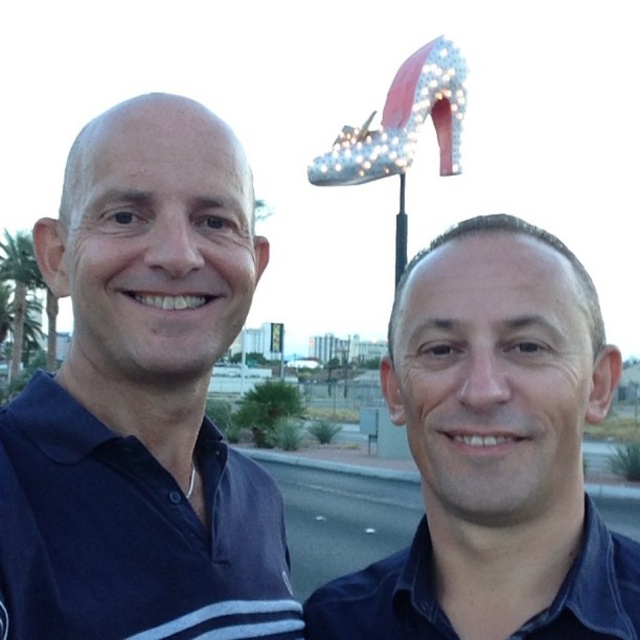
You are taking a photo of the blue cotton polo shirt at left and the green leafy palm tree at left. Which object appears narrower in the photo?

The blue cotton polo shirt at left appears narrower than the green leafy palm tree at left in the photo.

Consider the image. You are a photographer setting up for a group photo. You need to position two people so that there is at least 1.5 meters between them for proper framing. Can the current distance between the blue cotton polo shirt at left and the navy blue cotton polo shirt at center work?

The blue cotton polo shirt at left is 1.60 meters from the navy blue cotton polo shirt at center, which meets the required 1.5 meters distance. Therefore, the current distance works for proper framing.